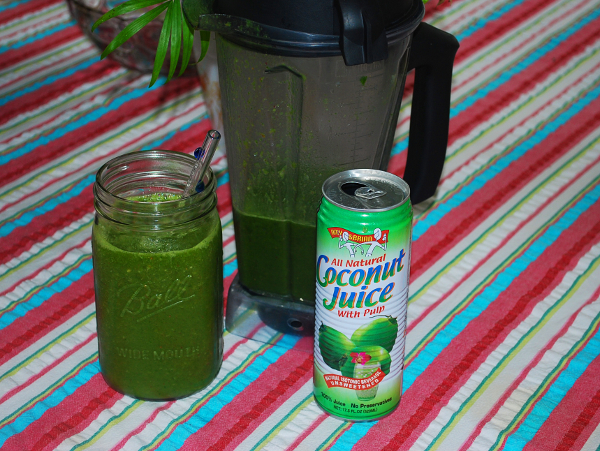
At what (x,y) coordinates should I click in order to perform the action: click on blender. Please return your answer as a coordinate pair (x, y). This screenshot has height=451, width=600. Looking at the image, I should click on (326, 102).